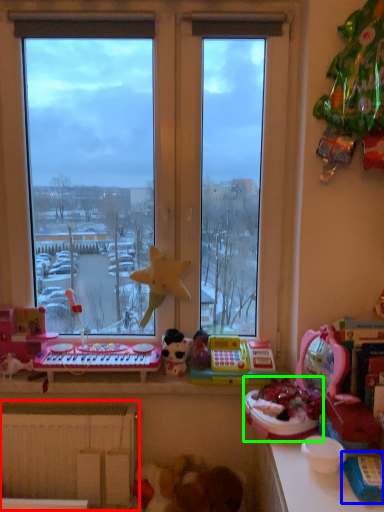
Question: Which is nearer to the radiator (highlighted by a red box)? toy (highlighted by a blue box) or toy (highlighted by a green box).

Choices:
 (A) toy
 (B) toy

Answer: (B)